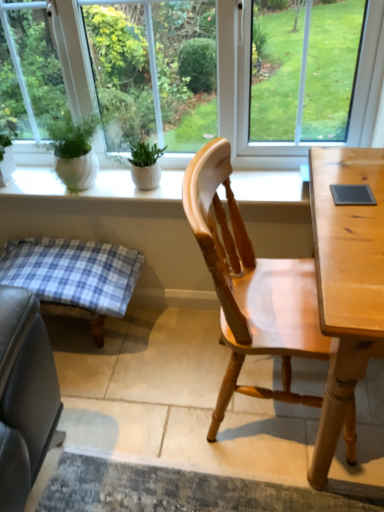
Question: Is blue plaid cushion at lower left to the left or to the right of light wood chair at center in the image?

Choices:
 (A) right
 (B) left

Answer: (B)

Question: Would you say blue plaid cushion at lower left is inside or outside light wood chair at center?

Choices:
 (A) outside
 (B) inside

Answer: (A)

Question: Which object is positioned closest to the transparent glass window at center?

Choices:
 (A) blue plaid cushion at lower left
 (B) light wood chair at center
 (C) white ceramic plant pots at upper center
 (D) green matte plant at center

Answer: (C)

Question: Estimate the real-world distances between objects in this image. Which object is closer to the white ceramic plant pots at upper center?

Choices:
 (A) blue plaid cushion at lower left
 (B) transparent glass window at center
 (C) green matte plant at center
 (D) light wood chair at center

Answer: (C)